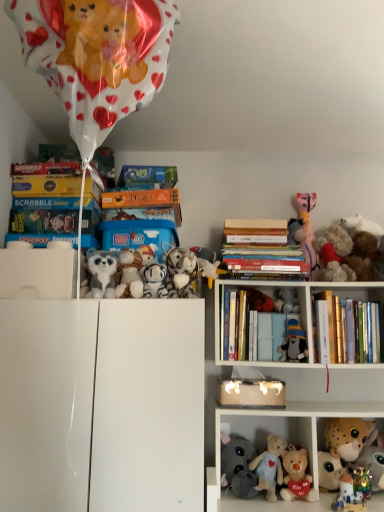
Question: Relative to hardcover book at upper center, the 1th book when ordered from left to right, is hardcover books at center, the 2th book when ordered from right to left, in front or behind?

Choices:
 (A) front
 (B) behind

Answer: (A)

Question: In terms of size, does hardcover books at center, the 2th book when ordered from right to left, appear bigger or smaller than hardcover book at upper center, which appears as the 4th book when viewed from the right?

Choices:
 (A) small
 (B) big

Answer: (B)

Question: Which object is the closest to the hardcover books at center, the 2th book when ordered from right to left?

Choices:
 (A) white glossy cabinet at center, the 2th shelf viewed from the right
 (B) white plush toy at upper center, which appears as the 3th toy when viewed from the left
 (C) white plush toy at upper center, which is the 7th toy from left to right
 (D) fluffy white plush at upper left, the 12th toy viewed from the right
 (E) hardcover book at upper center, the third book ordered from the bottom

Answer: (B)

Question: Which object is positioned closest to the hardcover book at upper center, which appears as the 4th book when viewed from the right?

Choices:
 (A) hardcover books at upper right, positioned as the 2th shelf in left-to-right order
 (B) white plush toy at upper center, which is the 7th toy from left to right
 (C) fluffy plush toys at right, arranged as the tenth toy when viewed from the left
 (D) fluffy white plush at upper left, the 12th toy viewed from the right
 (E) shiny metallic robot at lower right, arranged as the 4th toy when viewed from the right

Answer: (D)